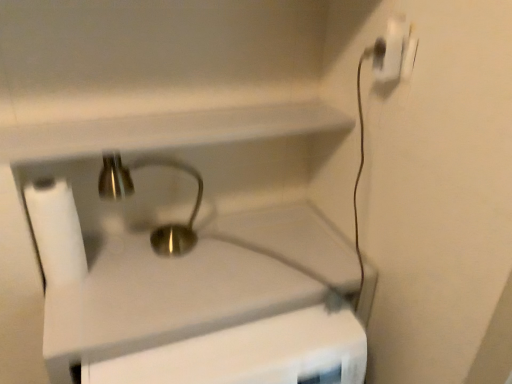
The width and height of the screenshot is (512, 384). What are the coordinates of `vacant space behind white matte toilet paper at left` in the screenshot? It's located at (124, 239).